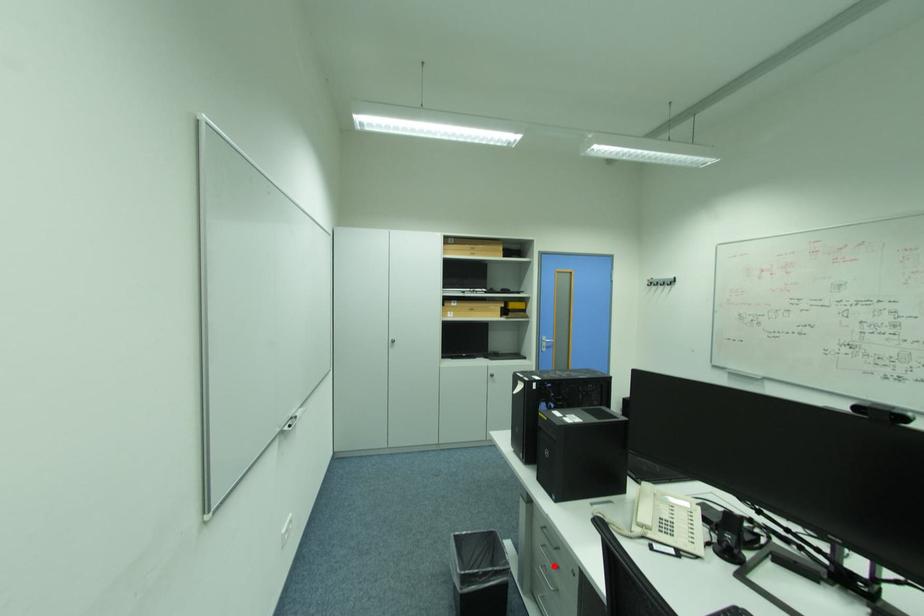
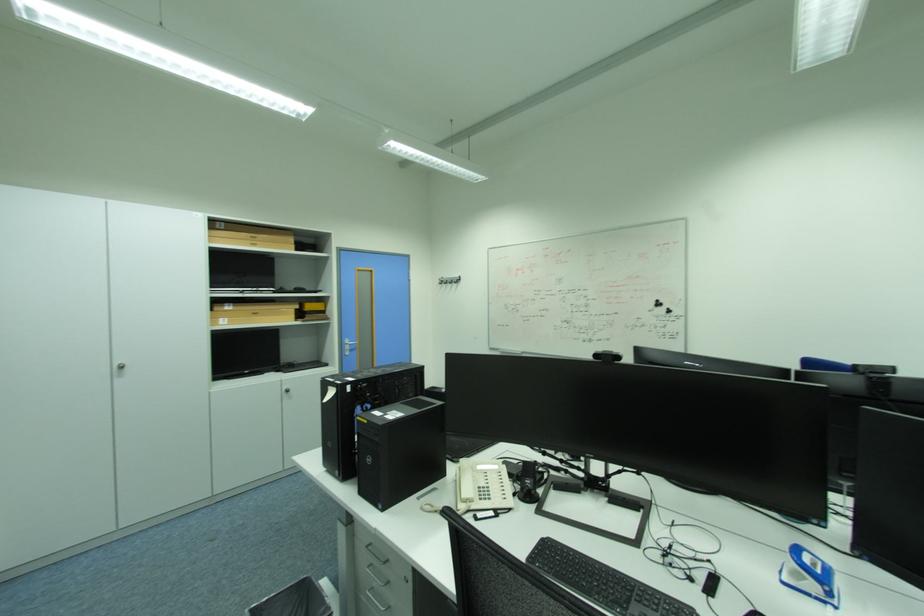
Locate, in the second image, the point that corresponds to the highlighted location in the first image.

(382, 585)